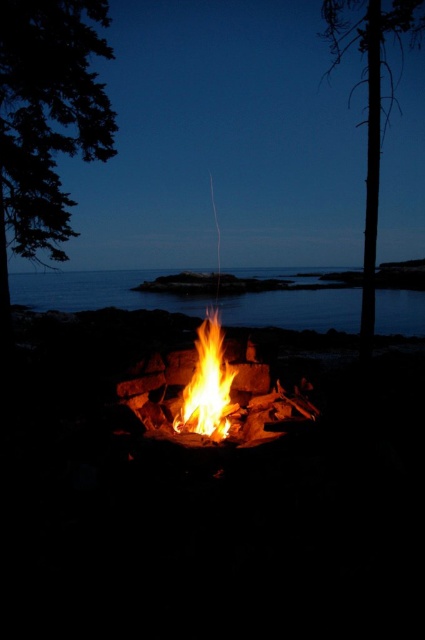
Question: Is green leafy tree at left bigger than flamewoodenbonfire at center?

Choices:
 (A) yes
 (B) no

Answer: (A)

Question: Observing the image, what is the correct spatial positioning of flaming wood fire pit at center in reference to transparent water at center?

Choices:
 (A) left
 (B) right

Answer: (B)

Question: Which point appears farthest from the camera in this image?

Choices:
 (A) (163, 385)
 (B) (28, 205)

Answer: (B)

Question: Which of these objects is positioned closest to the green leafy tree at left?

Choices:
 (A) smooth bark tree at right
 (B) flamewoodenbonfire at center

Answer: (B)

Question: Does green leafy tree at left appear on the right side of flamewoodenbonfire at center?

Choices:
 (A) no
 (B) yes

Answer: (A)

Question: Which point appears farthest from the camera in this image?

Choices:
 (A) (359, 28)
 (B) (317, 291)
 (C) (226, 404)
 (D) (195, 396)

Answer: (A)